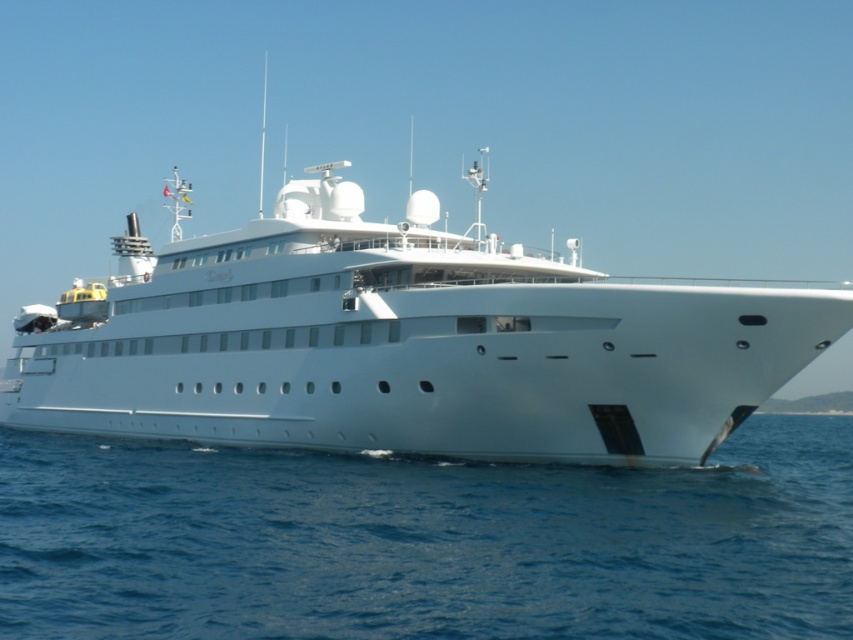
Question: In this image, where is white glossy yacht at center located relative to blue water at lower right?

Choices:
 (A) right
 (B) left

Answer: (B)

Question: Can you confirm if white glossy yacht at center is wider than blue water at lower right?

Choices:
 (A) yes
 (B) no

Answer: (A)

Question: Does white glossy yacht at center have a smaller size compared to blue water at lower right?

Choices:
 (A) no
 (B) yes

Answer: (A)

Question: Which point is closer to the camera?

Choices:
 (A) (114, 374)
 (B) (22, 440)

Answer: (A)

Question: Which of the following is the farthest from the observer?

Choices:
 (A) (553, 566)
 (B) (135, 273)

Answer: (B)